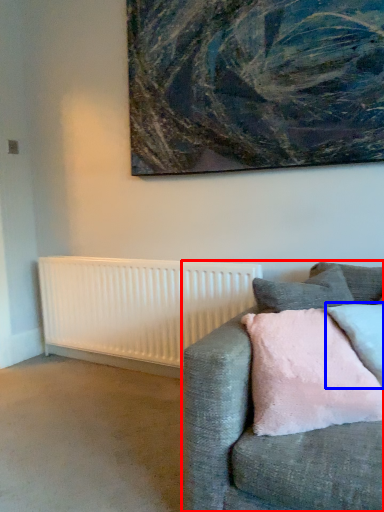
Question: Which object appears farthest to the camera in this image, studio couch (highlighted by a red box) or pillow (highlighted by a blue box)?

Choices:
 (A) studio couch
 (B) pillow

Answer: (B)